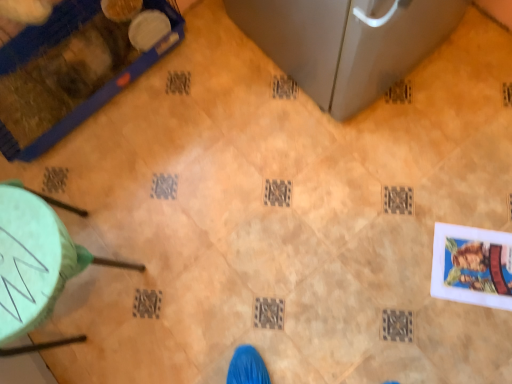
Question: From the image's perspective, is blue plastic pet cage at upper left, which is the 2th furniture in bottom-to-top order, above or below green plastic stool at lower left, the 2th furniture in the top-to-bottom sequence?

Choices:
 (A) above
 (B) below

Answer: (A)

Question: Considering the positions of blue plastic pet cage at upper left, which is the 2th furniture in bottom-to-top order, and green plastic stool at lower left, placed as the first furniture when sorted from bottom to top, in the image, is blue plastic pet cage at upper left, which is the 2th furniture in bottom-to-top order, bigger or smaller than green plastic stool at lower left, placed as the first furniture when sorted from bottom to top,?

Choices:
 (A) small
 (B) big

Answer: (B)

Question: In terms of height, does blue plastic pet cage at upper left, which appears as the first furniture when viewed from the top, look taller or shorter compared to green plastic stool at lower left, the 2th furniture in the top-to-bottom sequence?

Choices:
 (A) tall
 (B) short

Answer: (B)

Question: Considering the relative positions of green plastic stool at lower left, placed as the first furniture when sorted from bottom to top, and blue plastic pet cage at upper left, which appears as the first furniture when viewed from the top, in the image provided, is green plastic stool at lower left, placed as the first furniture when sorted from bottom to top, to the left or to the right of blue plastic pet cage at upper left, which appears as the first furniture when viewed from the top,?

Choices:
 (A) left
 (B) right

Answer: (B)

Question: Considering their positions, is green plastic stool at lower left, placed as the first furniture when sorted from bottom to top, located in front of or behind blue plastic pet cage at upper left, which is the 2th furniture in bottom-to-top order?

Choices:
 (A) behind
 (B) front

Answer: (B)

Question: Would you say green plastic stool at lower left, placed as the first furniture when sorted from bottom to top, is inside or outside blue plastic pet cage at upper left, which appears as the first furniture when viewed from the top?

Choices:
 (A) inside
 (B) outside

Answer: (B)

Question: From a real-world perspective, relative to blue plastic pet cage at upper left, which is the 2th furniture in bottom-to-top order, is green plastic stool at lower left, the 2th furniture in the top-to-bottom sequence, vertically above or below?

Choices:
 (A) above
 (B) below

Answer: (A)